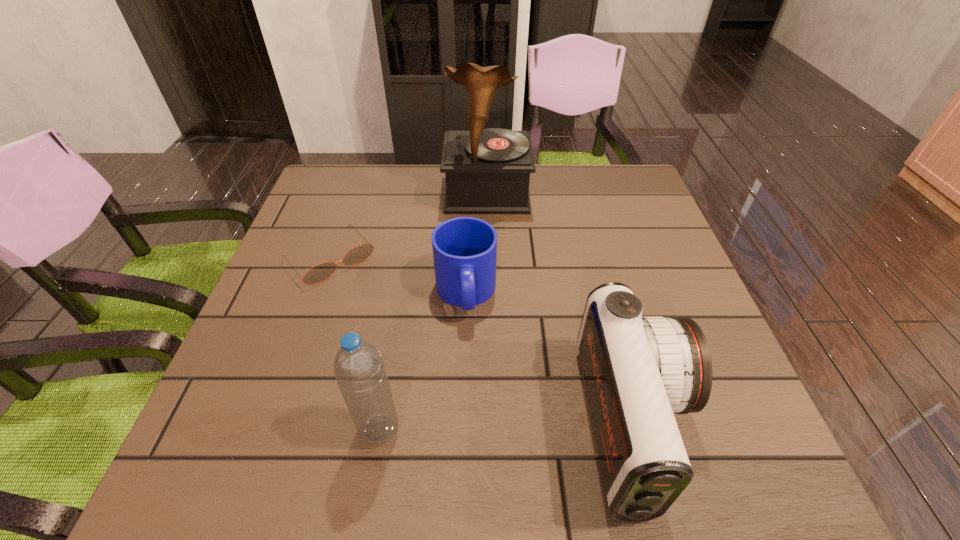
The height and width of the screenshot is (540, 960). Identify the location of water bottle located in the near edge section of the desktop. (x=359, y=369).

You are a GUI agent. You are given a task and a screenshot of the screen. Output one action in this format:
    pyautogui.click(x=<x>, y=<y>)
    Task: Click on the camcorder located at the near edge
    
    Given the screenshot: What is the action you would take?
    pyautogui.click(x=638, y=370)

Locate an element on the screen. object at the left edge is located at coordinates (319, 273).

The width and height of the screenshot is (960, 540). What are the coordinates of `object that is at the right edge` in the screenshot? It's located at (638, 370).

Identify the location of object present at the near right corner. The image size is (960, 540). (638, 370).

In the image, there is a desktop. Identify the location of free space at the far edge. The width and height of the screenshot is (960, 540). (373, 211).

This screenshot has width=960, height=540. What are the coordinates of `free point at the near edge` in the screenshot? It's located at (342, 411).

At what (x,y) coordinates should I click in order to perform the action: click on blank area at the left edge. Please return your answer as a coordinate pair (x, y). The width and height of the screenshot is (960, 540). Looking at the image, I should click on (320, 222).

At what (x,y) coordinates should I click in order to perform the action: click on free space at the right edge of the desktop. Please return your answer as a coordinate pair (x, y). Image resolution: width=960 pixels, height=540 pixels. Looking at the image, I should click on (659, 247).

Identify the location of vacant space at the near left corner of the desktop. (255, 418).